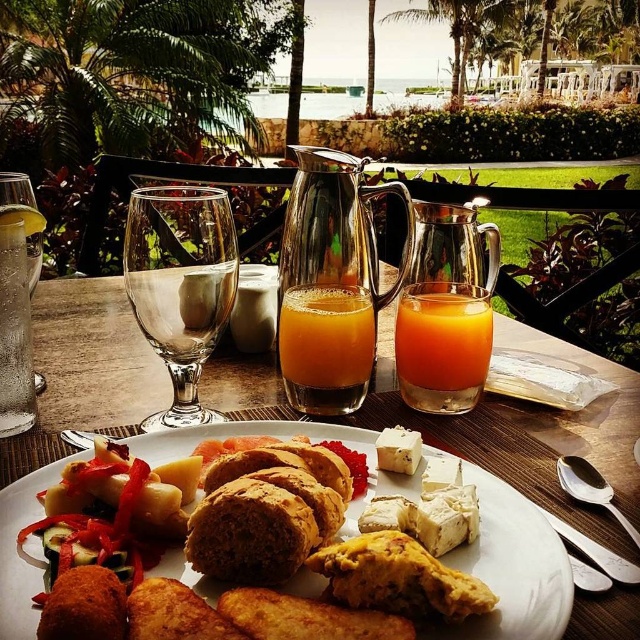
Is transparent glass wine glass at center bigger than translucent glass orange juice at center?

Indeed, transparent glass wine glass at center has a larger size compared to translucent glass orange juice at center.

Can you confirm if transparent glass wine glass at center is positioned to the right of translucent glass orange juice at center?

No, transparent glass wine glass at center is not to the right of translucent glass orange juice at center.

Is point (156, 230) in front of point (408, 355)?

Yes, point (156, 230) is closer to viewer.

Locate an element on the screen. The image size is (640, 640). transparent glass wine glass at center is located at coordinates (180, 285).

Who is more forward, (x=573, y=486) or (x=618, y=564)?

Point (x=618, y=564) is more forward.

Based on the photo, is satin silver spoon at lower right wider than silver spoon at upper right?

In fact, satin silver spoon at lower right might be narrower than silver spoon at upper right.

Does point (572, 474) come behind point (605, 557)?

That is True.

Where is `satin silver spoon at lower right`? Image resolution: width=640 pixels, height=640 pixels. satin silver spoon at lower right is located at coordinates (589, 488).

Does translucent glass orange juice at center have a lesser height compared to orange liquid at center?

Yes, translucent glass orange juice at center is shorter than orange liquid at center.

Does translucent glass orange juice at center have a greater width compared to orange liquid at center?

Incorrect, translucent glass orange juice at center's width does not surpass orange liquid at center's.

Is point (436, 372) more distant than point (296, 337)?

Yes.

Identify the location of translucent glass orange juice at center. (442, 346).